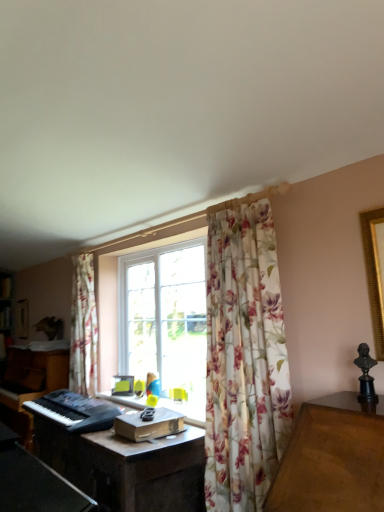
Question: From a real-world perspective, is black plastic keyboard at lower left under floral fabric curtain at center?

Choices:
 (A) yes
 (B) no

Answer: (A)

Question: Is black plastic keyboard at lower left positioned behind floral fabric curtain at center?

Choices:
 (A) no
 (B) yes

Answer: (B)

Question: Could floral fabric curtain at center be considered to be inside black plastic keyboard at lower left?

Choices:
 (A) yes
 (B) no

Answer: (B)

Question: From a real-world perspective, is black plastic keyboard at lower left positioned over floral fabric curtain at center based on gravity?

Choices:
 (A) no
 (B) yes

Answer: (A)

Question: Would you say black plastic keyboard at lower left is a long distance from floral fabric curtain at center?

Choices:
 (A) yes
 (B) no

Answer: (B)

Question: Does black plastic keyboard at lower left have a smaller size compared to floral fabric curtain at center?

Choices:
 (A) yes
 (B) no

Answer: (A)

Question: From the image's perspective, is black plastic keyboard at lower left located above floral fabric curtain at left?

Choices:
 (A) no
 (B) yes

Answer: (A)

Question: From the image's perspective, is black plastic keyboard at lower left below floral fabric curtain at left?

Choices:
 (A) no
 (B) yes

Answer: (B)

Question: Can you confirm if black plastic keyboard at lower left is thinner than floral fabric curtain at left?

Choices:
 (A) yes
 (B) no

Answer: (B)

Question: Does black plastic keyboard at lower left have a larger size compared to floral fabric curtain at left?

Choices:
 (A) no
 (B) yes

Answer: (A)

Question: Would you say floral fabric curtain at left is part of black plastic keyboard at lower left's contents?

Choices:
 (A) yes
 (B) no

Answer: (B)

Question: Does black plastic keyboard at lower left lie behind floral fabric curtain at left?

Choices:
 (A) no
 (B) yes

Answer: (A)

Question: Is dark brown wooden computer desk at center far away from floral fabric curtain at center?

Choices:
 (A) yes
 (B) no

Answer: (B)